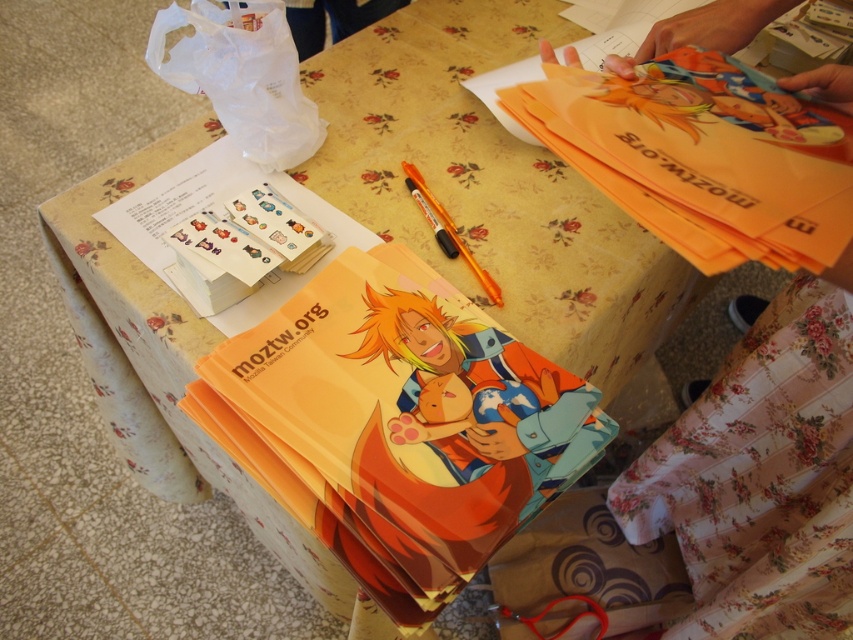
Who is taller, orange plastic pen at center or metallic orange scissors at lower center?

orange plastic pen at center is taller.

Does point (425, 184) lie in front of point (556, 598)?

Yes, point (425, 184) is in front of point (556, 598).

Where is `orange plastic pen at center`? The height and width of the screenshot is (640, 853). orange plastic pen at center is located at coordinates pyautogui.click(x=453, y=234).